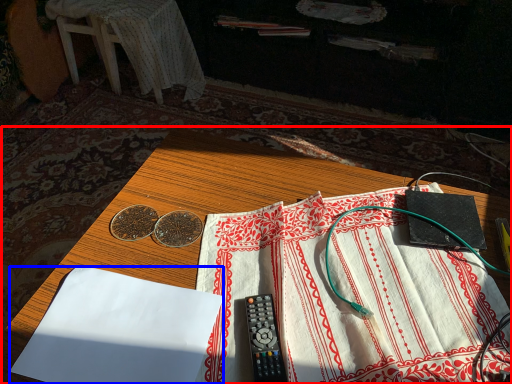
Question: Which of the following is the closest to the observer, table (highlighted by a red box) or sheet (highlighted by a blue box)?

Choices:
 (A) table
 (B) sheet

Answer: (A)